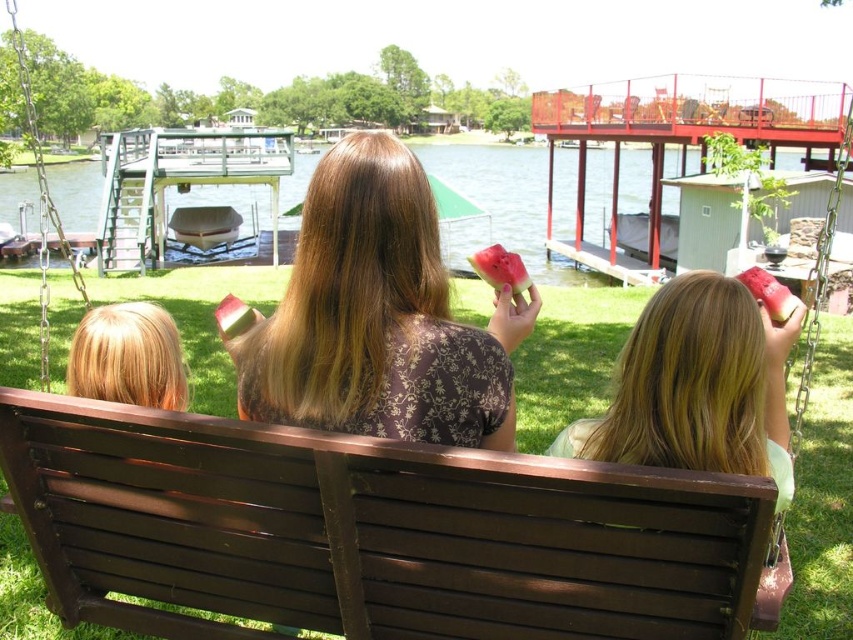
Question: Which of the following is the farthest from the observer?

Choices:
 (A) brown floral shirt at center
 (B) brushed metal boat at center
 (C) green grass at center

Answer: (B)

Question: Which object is the farthest from the green grass at center?

Choices:
 (A) brown wooden bench at center
 (B) brown floral shirt at center

Answer: (B)

Question: Can you confirm if brown wooden bench at center is positioned to the left of green grass at center?

Choices:
 (A) yes
 (B) no

Answer: (B)

Question: Does brown floral shirt at center have a lesser width compared to brushed metal boat at center?

Choices:
 (A) no
 (B) yes

Answer: (B)

Question: Is brown wooden bench at center above green grass at center?

Choices:
 (A) no
 (B) yes

Answer: (A)

Question: Among these objects, which one is nearest to the camera?

Choices:
 (A) brown floral shirt at center
 (B) green grass at center
 (C) brown wooden bench at center
 (D) brushed metal boat at center

Answer: (C)